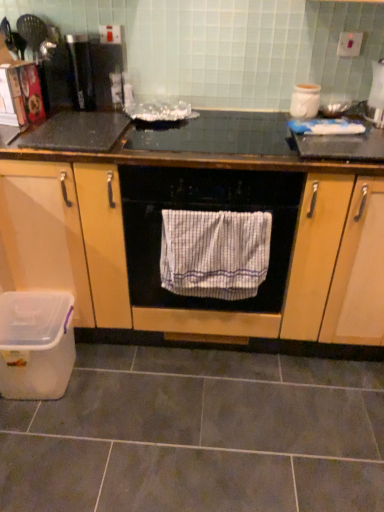
The width and height of the screenshot is (384, 512). I want to click on vacant area on top of gray matte tile at lower center (from a real-world perspective), so click(187, 417).